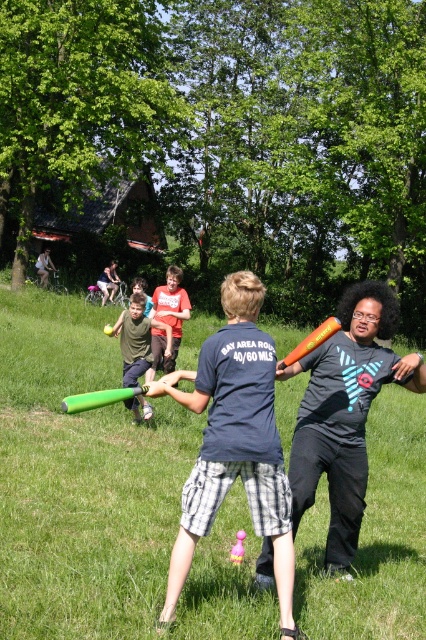
You are trying to decide which bat to use for a game of catch with a small ball. The matte orange bat at center and the green rubber bat at center are both available. Which bat would be more suitable for handling a small ball due to its size?

The matte orange bat at center has a lesser width compared to the green rubber bat at center, making it more suitable for handling a small ball due to its narrower size.

You are a photographer standing in the grassy field. You want to take a photo of both the matte orange bat at center and the green plastic bat at center. Which bat should you focus on first to ensure both are in clear view?

You should focus on the matte orange bat at center first since it is closer to you than the green plastic bat at center, ensuring both are in clear view.

You are a referee in a foam bat game. You see two bats at the center of the field. According to the rules, the bat must be taller than 50 cm to be used. Can both the green foam bat at center and the green plastic bat at center be used?

The green plastic bat at center is taller than the green foam bat at center. Since the green foam bat at center is shorter than the green plastic bat at center, it might not meet the 50 cm requirement. However, without knowing the exact height of the green plastic bat at center, we cannot confirm if both bats meet the rule.